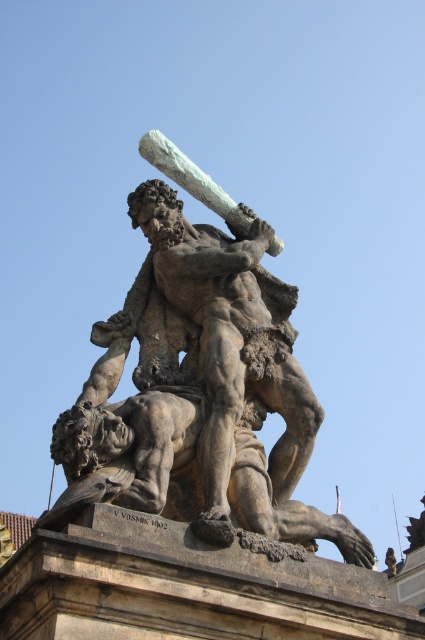
How far apart are matte stone sculpture at center and rough stone statue at center?

matte stone sculpture at center is 13.74 inches from rough stone statue at center.

Does matte stone sculpture at center have a lesser height compared to rough stone statue at center?

Incorrect, matte stone sculpture at center's height does not fall short of rough stone statue at center's.

Where is `matte stone sculpture at center`? The width and height of the screenshot is (425, 640). matte stone sculpture at center is located at coordinates (198, 381).